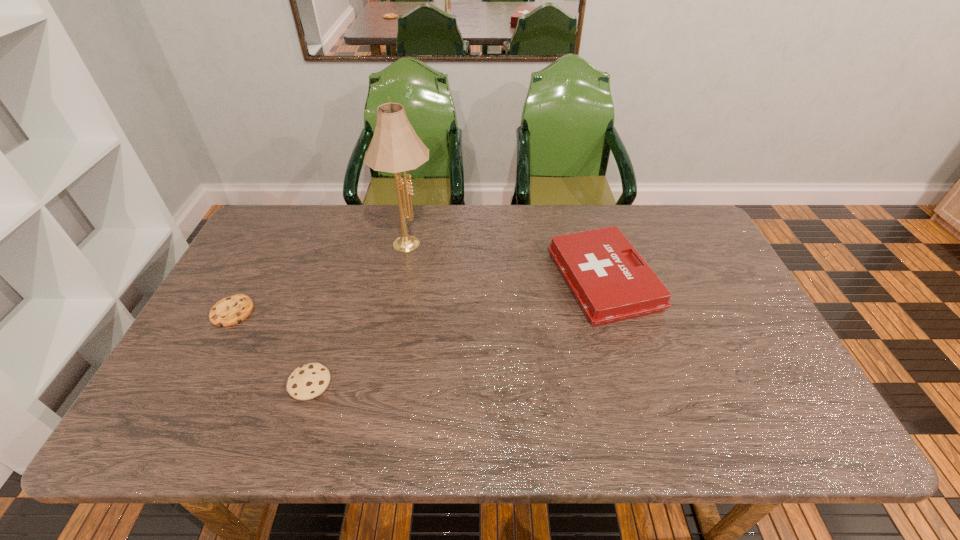
Where is `the tallest object`? The height and width of the screenshot is (540, 960). the tallest object is located at coordinates (395, 147).

Find the location of `lampshade`. lampshade is located at coordinates (395, 147).

The height and width of the screenshot is (540, 960). In order to click on the first-aid kit in this screenshot , I will do `click(610, 284)`.

Where is `the rightmost object`? the rightmost object is located at coordinates (610, 284).

The image size is (960, 540). I want to click on the third object from right to left, so click(x=306, y=382).

Where is `the right cookie`? The width and height of the screenshot is (960, 540). the right cookie is located at coordinates (306, 382).

This screenshot has height=540, width=960. I want to click on the leftmost object, so click(234, 309).

You are a GUI agent. You are given a task and a screenshot of the screen. Output one action in this format:
    pyautogui.click(x=<x>, y=<y>)
    Task: Click on the left cookie
    The width and height of the screenshot is (960, 540).
    Given the screenshot: What is the action you would take?
    pyautogui.click(x=234, y=309)

Locate an element on the screen. The height and width of the screenshot is (540, 960). vacant area located on the right of the tallest object is located at coordinates (514, 240).

Locate an element on the screen. free spot located 0.310m on the left of the first-aid kit is located at coordinates (446, 280).